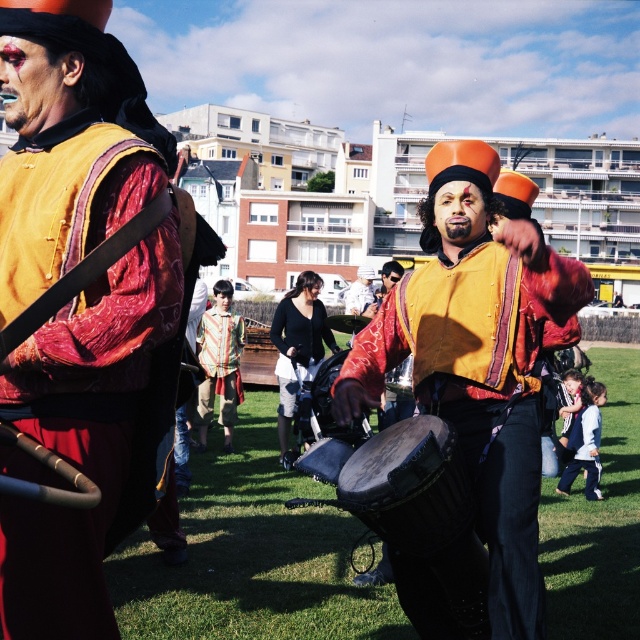
You are a photographer trying to capture the best shot of the event. You notice two important points in the scene at coordinates point (488, 544) and point (280, 360). Which point should you focus on to ensure it appears closer to the camera in your photo?

Point (488, 544) is in front of point (280, 360), so focusing on point (488, 544) will make it appear closer to the camera in the photo.

You are a photographer trying to capture the perfect shot of the dark brown leather drum at center. The scene is crowded, so you need to move to a specific location to get a clear view. Based on the coordinates provided, where should you position yourself relative to the drum to ensure it is centered in your photo?

To center the dark brown leather drum at center in your photo, you should position yourself directly in front of it at the coordinates provided, ensuring the drum is aligned with the center point of your camera frame.

You are an event photographer trying to capture the perfect shot of the black cotton shirt at center. Based on its 2D coordinates, where should you position your camera to ensure it is centered in the frame?

The black cotton shirt at center is located at coordinates point [298,342], so positioning the camera to align the crosshairs at those coordinates will center it in the frame.